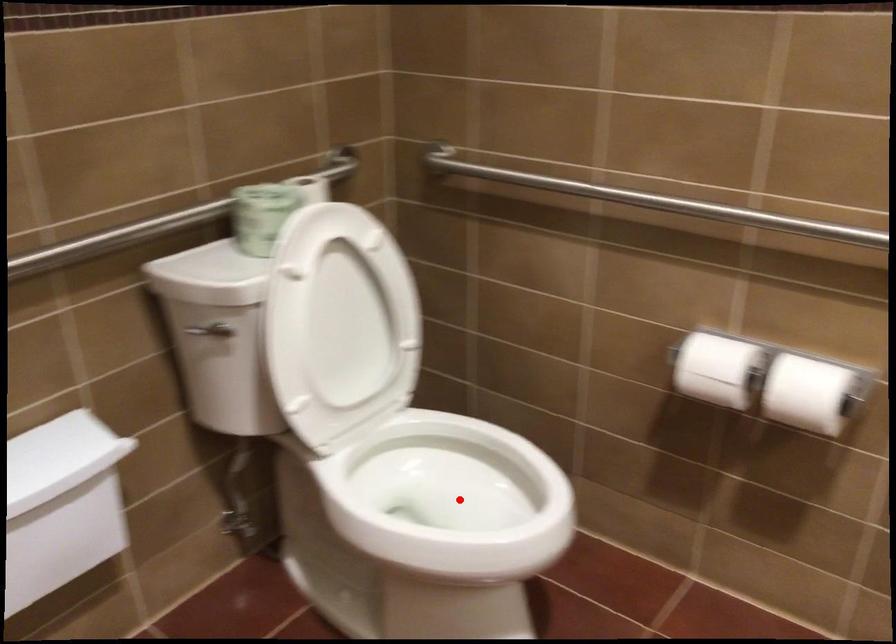
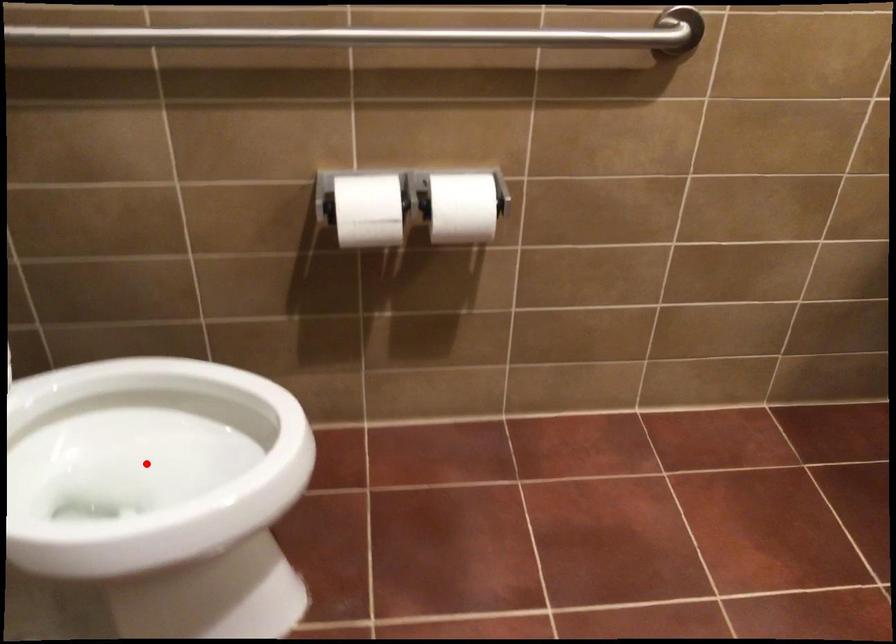
I am providing you with two images of the same scene from different viewpoints. A red point is marked on the first image and another point is marked on the second image. Is the marked point in image1 the same physical position as the marked point in image2?

Yes